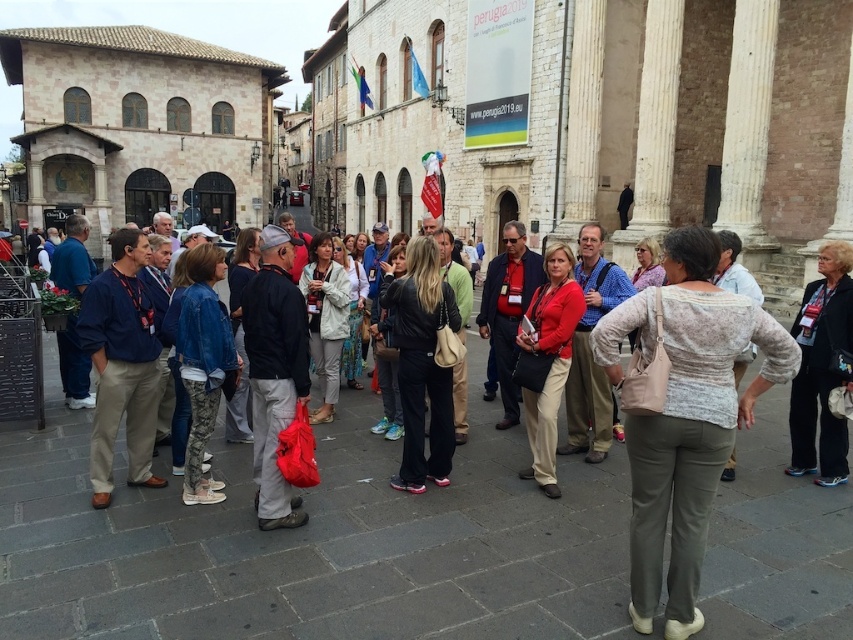
Question: Is light gray fabric jacket at center to the right of light blue denim jacket at center from the viewer's perspective?

Choices:
 (A) yes
 (B) no

Answer: (B)

Question: Is blue fabric jacket at left above light gray sweater at center?

Choices:
 (A) yes
 (B) no

Answer: (B)

Question: Estimate the real-world distances between objects in this image. Which object is closer to the light blue denim jacket at center?

Choices:
 (A) black leather jacket at center
 (B) denim jacket at center
 (C) light beige textured blouse at center
 (D) light gray sweater at center

Answer: (A)

Question: Which object appears farthest from the camera in this image?

Choices:
 (A) light blue denim jacket at center
 (B) matte red shirt at center
 (C) denim jacket at center
 (D) black leather jacket at center

Answer: (A)

Question: Can you confirm if matte black jacket at center is positioned to the left of light blue denim jacket at center?

Choices:
 (A) no
 (B) yes

Answer: (B)

Question: Which of the following is the closest to the observer?

Choices:
 (A) (845, 280)
 (B) (152, 316)
 (C) (444, 406)

Answer: (A)